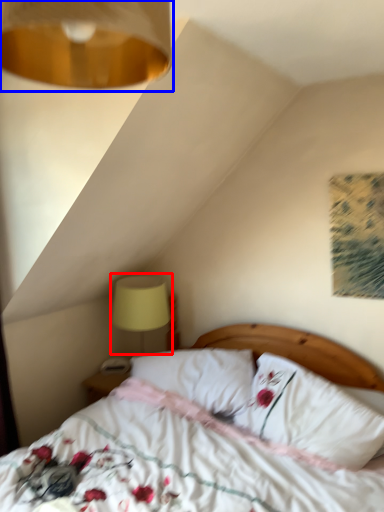
Question: Which object appears farthest to the camera in this image, table lamp (highlighted by a red box) or lamp (highlighted by a blue box)?

Choices:
 (A) table lamp
 (B) lamp

Answer: (A)